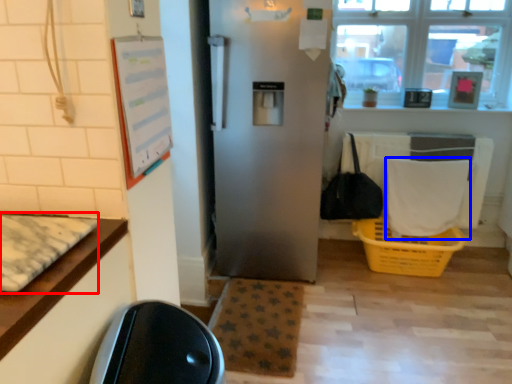
Question: Which object appears farthest to the camera in this image, mat (highlighted by a red box) or laundry (highlighted by a blue box)?

Choices:
 (A) mat
 (B) laundry

Answer: (B)